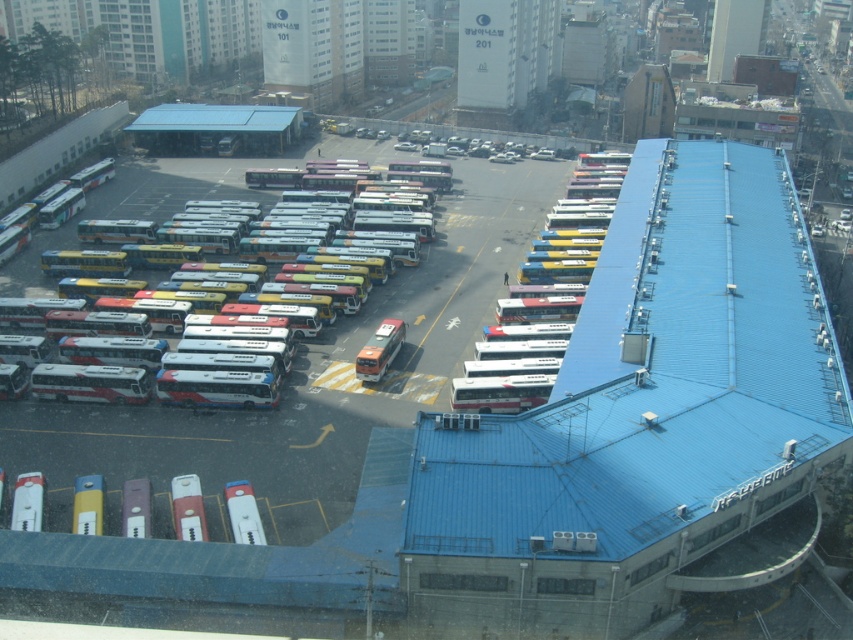
Does white matte bus at left appear on the right side of metallic silver bus at lower left?

In fact, white matte bus at left is to the left of metallic silver bus at lower left.

Can you confirm if white matte bus at left is bigger than metallic silver bus at lower left?

Yes.

Describe the element at coordinates (137, 205) in the screenshot. Image resolution: width=853 pixels, height=640 pixels. I see `white matte bus at left` at that location.

Image resolution: width=853 pixels, height=640 pixels. What are the coordinates of `white matte bus at left` in the screenshot? It's located at pyautogui.click(x=137, y=205).

From the picture: Can you confirm if white glossy bus at center-right is thinner than metallic silver bus at lower left?

No, white glossy bus at center-right is not thinner than metallic silver bus at lower left.

Who is positioned more to the left, white glossy bus at center-right or metallic silver bus at lower left?

Positioned to the left is metallic silver bus at lower left.

Does point (575, 273) come closer to viewer compared to point (186, 518)?

No, it is not.

The height and width of the screenshot is (640, 853). I want to click on white glossy bus at center-right, so click(532, 324).

Which is below, white matte bus at left or white glossy bus at center?

white glossy bus at center

Is white matte bus at left in front of white glossy bus at center?

Yes, white matte bus at left is closer to the viewer.

The image size is (853, 640). What do you see at coordinates (137, 205) in the screenshot? I see `white matte bus at left` at bounding box center [137, 205].

Find the location of `white matte bus at left`. white matte bus at left is located at coordinates (137, 205).